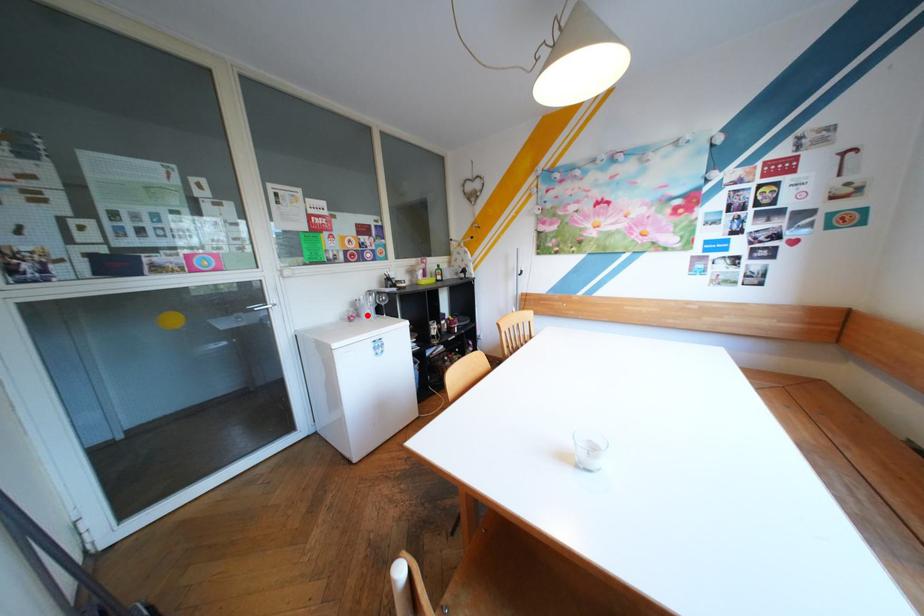
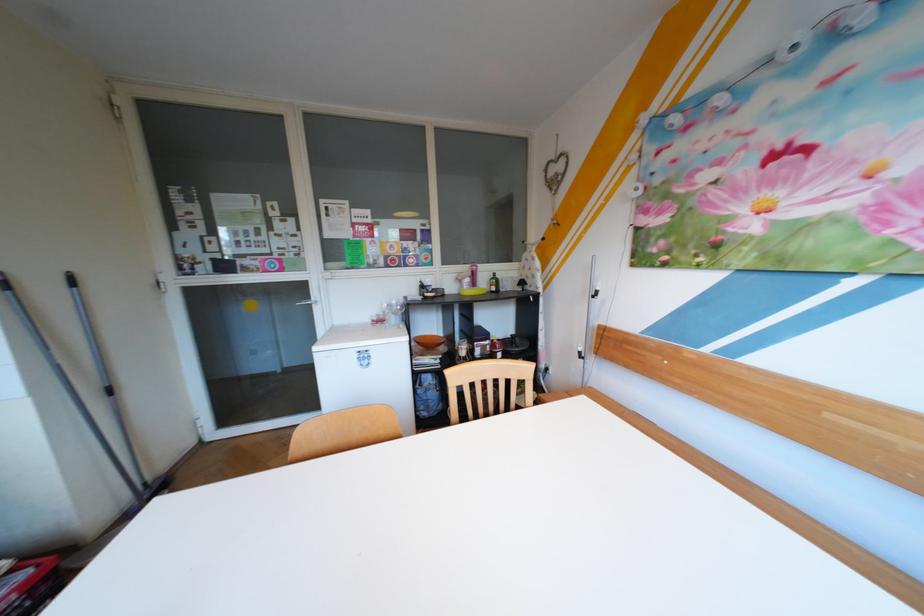
Where in the second image is the point corresponding to the highlighted location from the first image?

(393, 320)